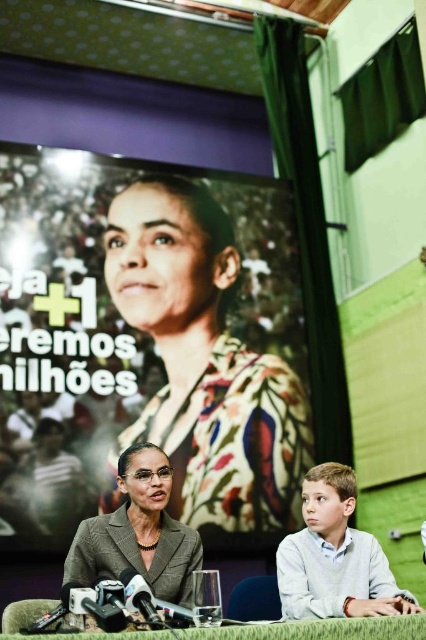
Is point (316, 468) positioned behind point (137, 500)?

Yes, it is behind point (137, 500).

Is point (305, 516) positioned in front of point (161, 572)?

No, it is not.

Is point (354, 568) closer to camera compared to point (164, 538)?

That is True.

Locate an element on the screen. This screenshot has width=426, height=640. light gray cotton shirt at lower right is located at coordinates (334, 556).

Describe the element at coordinates (334, 556) in the screenshot. This screenshot has height=640, width=426. I see `light gray cotton shirt at lower right` at that location.

Can you confirm if light gray cotton shirt at lower right is positioned above green fabric table at lower center?

Incorrect, light gray cotton shirt at lower right is not positioned above green fabric table at lower center.

Does point (321, 504) come closer to viewer compared to point (348, 636)?

No, (321, 504) is behind (348, 636).

Where is `light gray cotton shirt at lower right`? light gray cotton shirt at lower right is located at coordinates (334, 556).

Can you confirm if floral-patterned shirt at center is positioned to the right of gray textured blazer at center?

Correct, you'll find floral-patterned shirt at center to the right of gray textured blazer at center.

You are a GUI agent. You are given a task and a screenshot of the screen. Output one action in this format:
    pyautogui.click(x=<x>, y=<y>)
    Task: Click on the floral-patterned shirt at center
    The height and width of the screenshot is (640, 426).
    Given the screenshot: What is the action you would take?
    pyautogui.click(x=204, y=365)